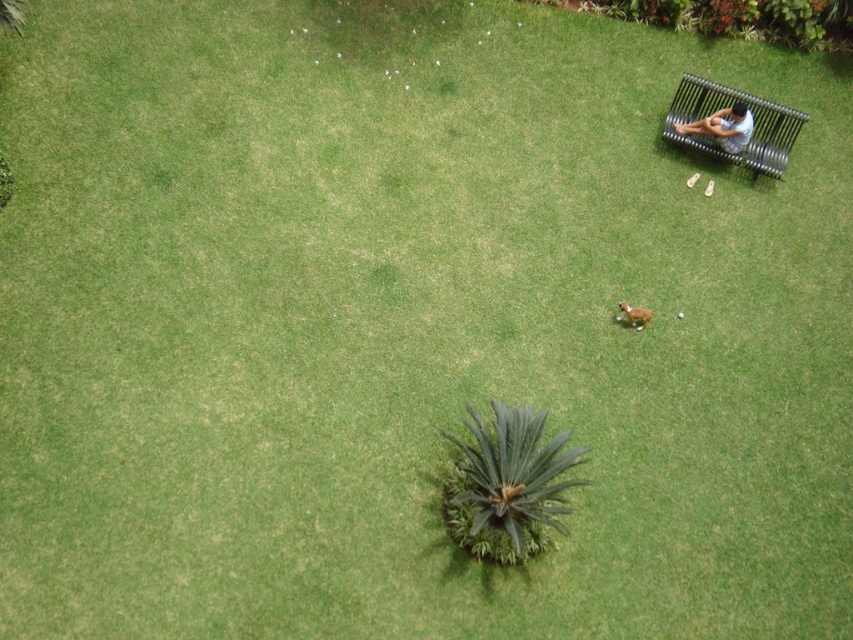
Which is behind, point (706, 150) or point (705, 129)?

The point (706, 150) is more distant.

Between metallic silver park bench at upper right and light blue fabric bench at upper right, which one is positioned lower?

light blue fabric bench at upper right is lower down.

Who is more forward, (700, 100) or (721, 147)?

Point (721, 147) is more forward.

The image size is (853, 640). In order to click on metallic silver park bench at upper right in this screenshot , I will do `click(753, 124)`.

Between point (730, 138) and point (631, 323), which one is positioned in front?

Point (631, 323)

Can you confirm if light blue fabric bench at upper right is taller than brown furry dog at center?

Yes.

Does point (729, 115) lie behind point (625, 301)?

Yes, it is behind point (625, 301).

At what (x,y) coordinates should I click in order to perform the action: click on light blue fabric bench at upper right. Please return your answer as a coordinate pair (x, y). The height and width of the screenshot is (640, 853). Looking at the image, I should click on (723, 128).

Locate an element on the screen. The height and width of the screenshot is (640, 853). metallic silver park bench at upper right is located at coordinates pyautogui.click(x=753, y=124).

Can you confirm if metallic silver park bench at upper right is positioned below brown furry dog at center?

No.

Is point (778, 147) positioned before point (628, 316)?

That is False.

Where is `metallic silver park bench at upper right`? metallic silver park bench at upper right is located at coordinates (753, 124).